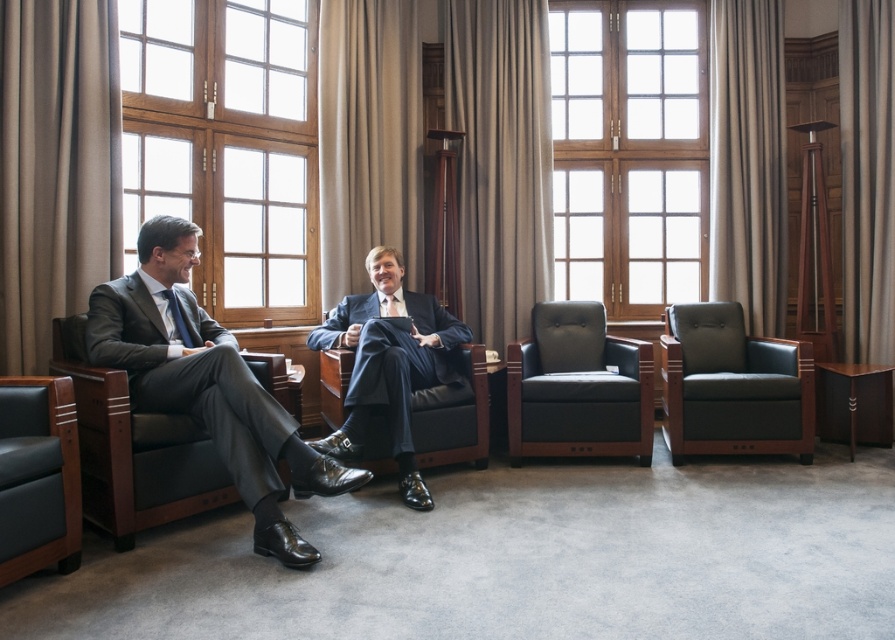
You are a GUI agent. You are given a task and a screenshot of the screen. Output one action in this format:
    pyautogui.click(x=<x>, y=<y>)
    Task: Click on the beige fabric curtain at center
    The width and height of the screenshot is (895, 640).
    Given the screenshot: What is the action you would take?
    pyautogui.click(x=500, y=161)

Who is more forward, (x=534, y=170) or (x=774, y=435)?

Point (x=774, y=435) is in front.

Which is behind, point (535, 218) or point (787, 385)?

The point (535, 218) is behind.

Where is `beige fabric curtain at center`? The height and width of the screenshot is (640, 895). beige fabric curtain at center is located at coordinates (500, 161).

Between brown fabric curtain at left and leather armchair at right, which one has more height?

Standing taller between the two is brown fabric curtain at left.

Is point (112, 170) less distant than point (799, 401)?

Yes, it is.

The height and width of the screenshot is (640, 895). In order to click on brown fabric curtain at left in this screenshot , I will do `click(55, 168)`.

Between beige fabric curtain at right and leather armchair at right, which one has less height?

leather armchair at right

Does beige fabric curtain at right have a greater height compared to leather armchair at right?

Correct, beige fabric curtain at right is much taller as leather armchair at right.

This screenshot has width=895, height=640. What do you see at coordinates (747, 161) in the screenshot?
I see `beige fabric curtain at right` at bounding box center [747, 161].

I want to click on beige fabric curtain at right, so click(x=747, y=161).